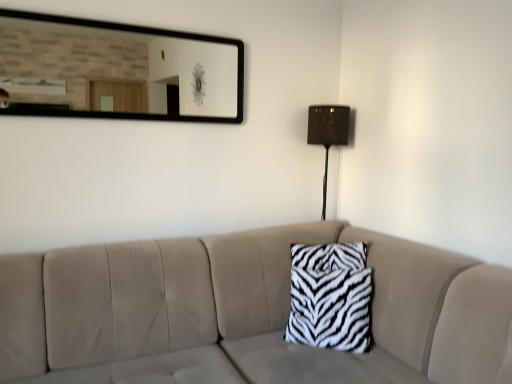
Question: Can you confirm if white zebra-patterned pillow at center is positioned to the left of zebra-patterned fabric pillow at center?

Choices:
 (A) no
 (B) yes

Answer: (A)

Question: From the image's perspective, does white zebra-patterned pillow at center appear lower than zebra-patterned fabric pillow at center?

Choices:
 (A) yes
 (B) no

Answer: (A)

Question: Does white zebra-patterned pillow at center come behind zebra-patterned fabric pillow at center?

Choices:
 (A) yes
 (B) no

Answer: (B)

Question: From the image's perspective, is white zebra-patterned pillow at center on top of zebra-patterned fabric pillow at center?

Choices:
 (A) yes
 (B) no

Answer: (B)

Question: Does white zebra-patterned pillow at center turn towards zebra-patterned fabric pillow at center?

Choices:
 (A) no
 (B) yes

Answer: (B)

Question: Choose the correct answer: Is matte brown table lamp at right inside black-framed mirror at upper center or outside it?

Choices:
 (A) outside
 (B) inside

Answer: (A)

Question: From the image's perspective, relative to black-framed mirror at upper center, is matte brown table lamp at right above or below?

Choices:
 (A) below
 (B) above

Answer: (A)

Question: Considering the positions of matte brown table lamp at right and black-framed mirror at upper center in the image, is matte brown table lamp at right taller or shorter than black-framed mirror at upper center?

Choices:
 (A) tall
 (B) short

Answer: (A)

Question: Is matte brown table lamp at right to the left or to the right of black-framed mirror at upper center in the image?

Choices:
 (A) left
 (B) right

Answer: (B)

Question: Considering the positions of matte brown table lamp at right and white zebra-patterned pillow at center in the image, is matte brown table lamp at right taller or shorter than white zebra-patterned pillow at center?

Choices:
 (A) short
 (B) tall

Answer: (A)

Question: From a real-world perspective, is matte brown table lamp at right physically located above or below white zebra-patterned pillow at center?

Choices:
 (A) above
 (B) below

Answer: (A)

Question: Is point (344, 119) closer or farther from the camera than point (67, 294)?

Choices:
 (A) closer
 (B) farther

Answer: (B)

Question: From the image's perspective, is matte brown table lamp at right above or below white zebra-patterned pillow at center?

Choices:
 (A) below
 (B) above

Answer: (B)

Question: In terms of height, does white zebra-patterned pillow at center look taller or shorter compared to zebra-patterned fabric pillow at center?

Choices:
 (A) tall
 (B) short

Answer: (A)

Question: Visually, is white zebra-patterned pillow at center positioned to the left or to the right of zebra-patterned fabric pillow at center?

Choices:
 (A) right
 (B) left

Answer: (A)